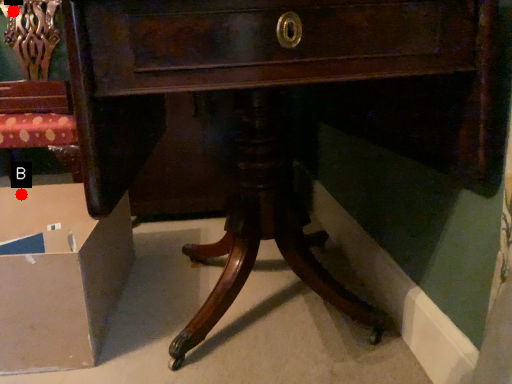
Question: Two points are circled on the image, labeled by A and B beside each circle. Which of the following is the closest to the observer?

Choices:
 (A) A is closer
 (B) B is closer

Answer: (B)